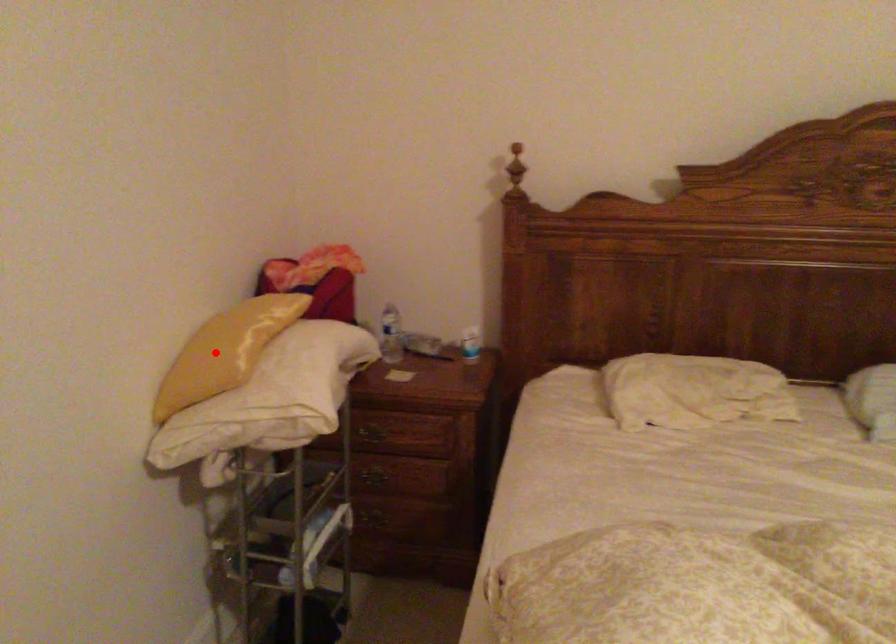
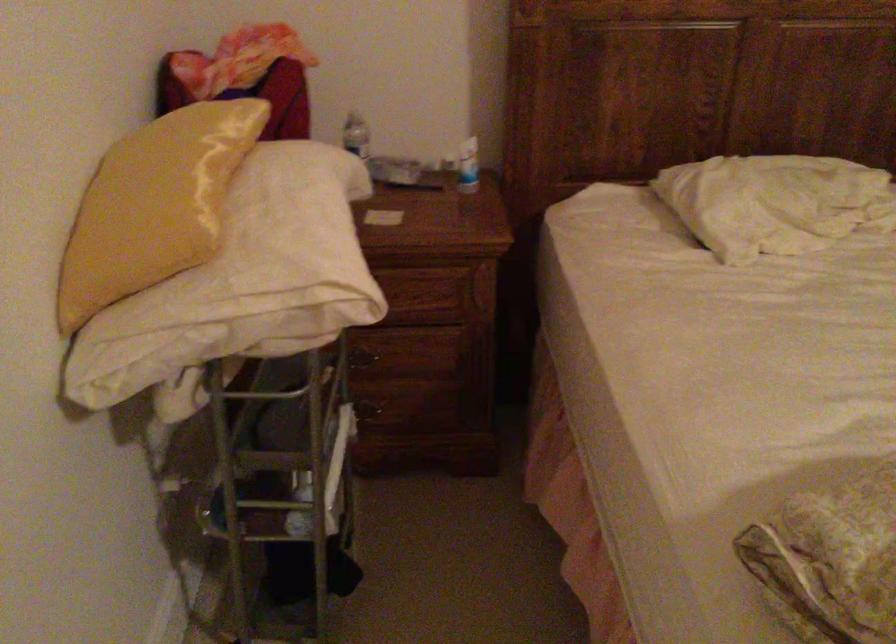
Question: A red point is marked in image1. In image2, is the corresponding 3D point closer to the camera or farther? Reply with the corresponding letter.

Choices:
 (A) The corresponding 3D point is closer.
 (B) The corresponding 3D point is farther.

Answer: (A)